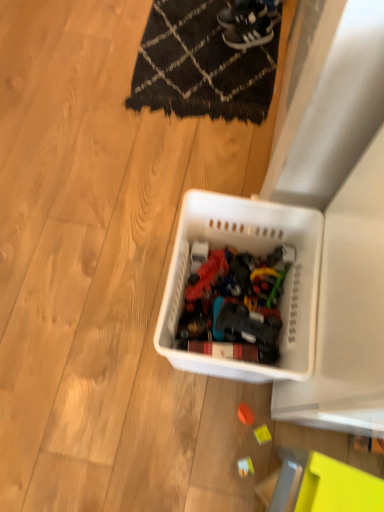
Find the location of a particular element. The image size is (384, 512). free space to the left of orange matte ball at center, acting as the 3th toy starting from the bottom is located at coordinates (190, 417).